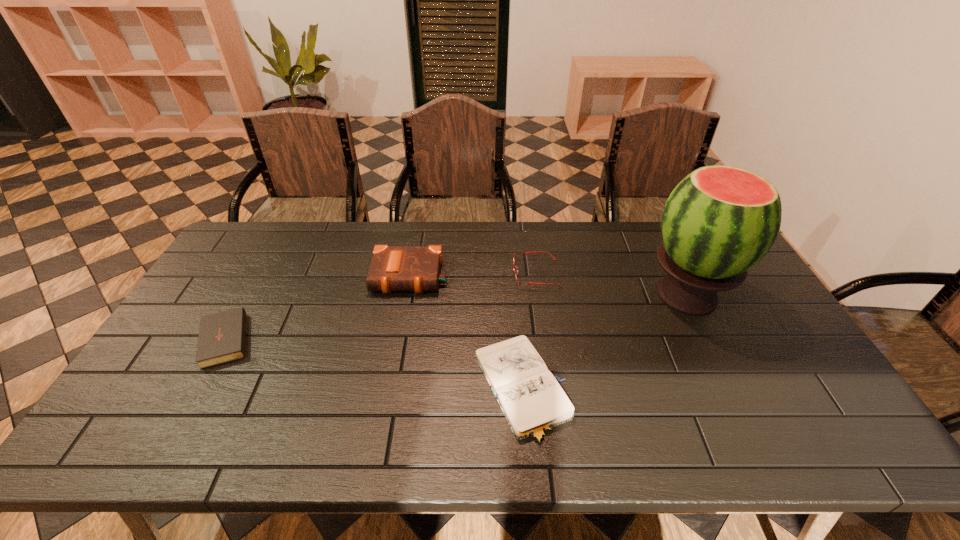
Locate an element on the screen. free space at the far edge of the desktop is located at coordinates (436, 243).

Where is `vacant space at the near edge`? vacant space at the near edge is located at coordinates (671, 426).

Where is `vacant region at the left edge of the desktop`? vacant region at the left edge of the desktop is located at coordinates (211, 289).

In the image, there is a desktop. Where is `free space at the right edge`? free space at the right edge is located at coordinates (781, 367).

Locate an element on the screen. Image resolution: width=960 pixels, height=540 pixels. free area in between the notebook and the second object from left to right is located at coordinates (467, 333).

Identify the location of vacant space that is in between the notebook and the tallest object. Image resolution: width=960 pixels, height=540 pixels. (605, 342).

The width and height of the screenshot is (960, 540). I want to click on free point between the second object from left to right and the watermelon, so click(549, 286).

At what (x,y) coordinates should I click in order to perform the action: click on empty location between the tallest object and the second object from left to right. Please return your answer as a coordinate pair (x, y). The height and width of the screenshot is (540, 960). Looking at the image, I should click on (549, 286).

Identify the location of vacant space in between the spectacles and the fourth object from right to left. (473, 275).

The height and width of the screenshot is (540, 960). In order to click on vacant point located between the leftmost object and the rightmost object in this screenshot , I will do `click(457, 315)`.